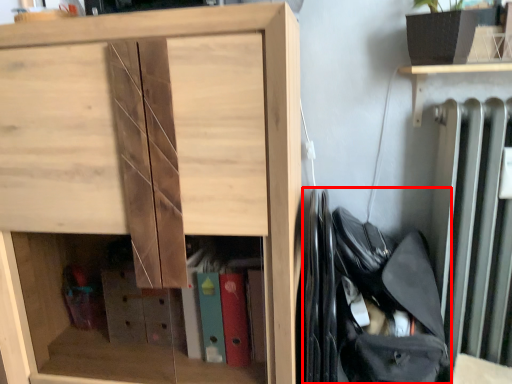
Question: From the image, what is the correct spatial relationship of bag (annotated by the red box) in relation to cupboard?

Choices:
 (A) left
 (B) right

Answer: (B)